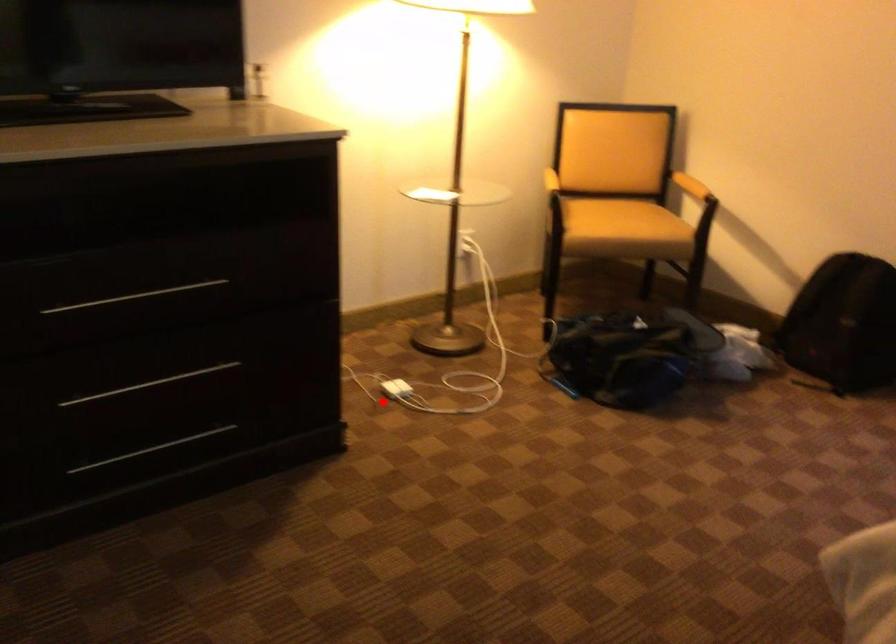
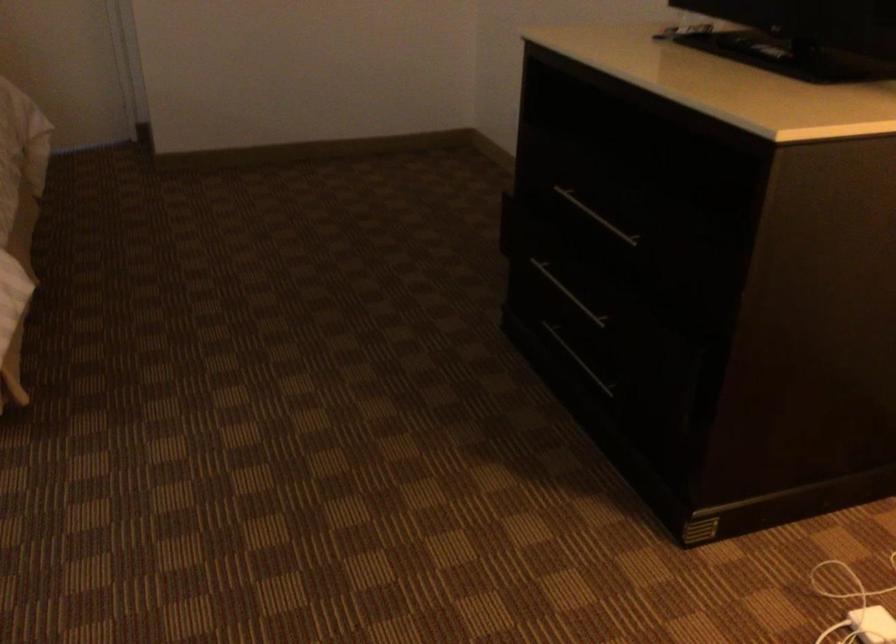
Locate, in the second image, the point that corresponds to the highlighted location in the first image.

(872, 625)